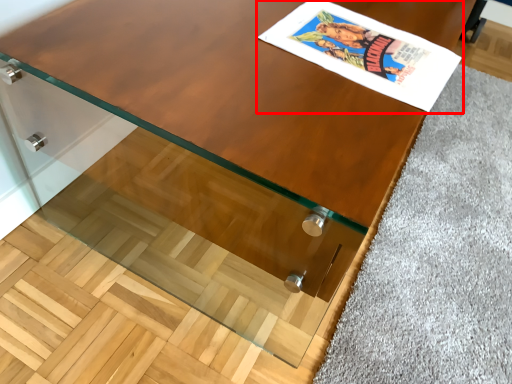
Question: From the image's perspective, considering the relative positions of comic book (annotated by the red box) and gray in the image provided, where is comic book (annotated by the red box) located with respect to the staircase?

Choices:
 (A) below
 (B) above

Answer: (B)